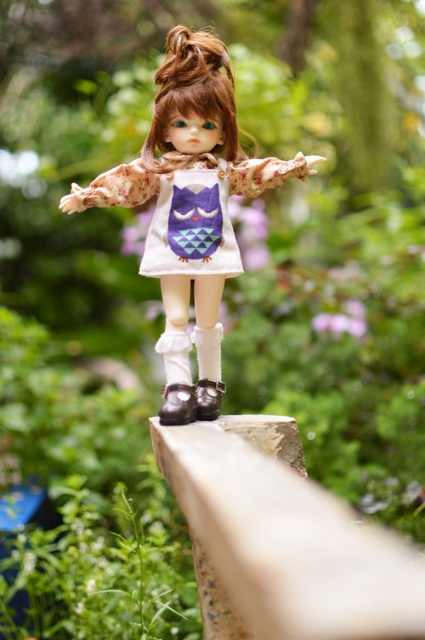
Question: Observing the image, what is the correct spatial positioning of white matte dress at center in reference to shiny brown shoe at lower center?

Choices:
 (A) right
 (B) left

Answer: (A)

Question: Does matte white dress at center appear under shiny brown shoe at lower center?

Choices:
 (A) yes
 (B) no

Answer: (B)

Question: Which of these objects is positioned closest to the shiny black leather shoe at lower center?

Choices:
 (A) wooden rail at center
 (B) matte white dress at center
 (C) shiny brown shoe at lower center

Answer: (C)

Question: Which of the following is the farthest from the observer?

Choices:
 (A) (187, 179)
 (B) (212, 314)
 (C) (215, 413)
 (D) (339, 586)

Answer: (C)

Question: Can you confirm if matte white dress at center is wider than shiny black leather shoe at lower center?

Choices:
 (A) yes
 (B) no

Answer: (A)

Question: Which point is closer to the camera?

Choices:
 (A) shiny black leather shoe at lower center
 (B) shiny brown shoe at lower center
 (C) white matte dress at center
 (D) wooden rail at center

Answer: (D)